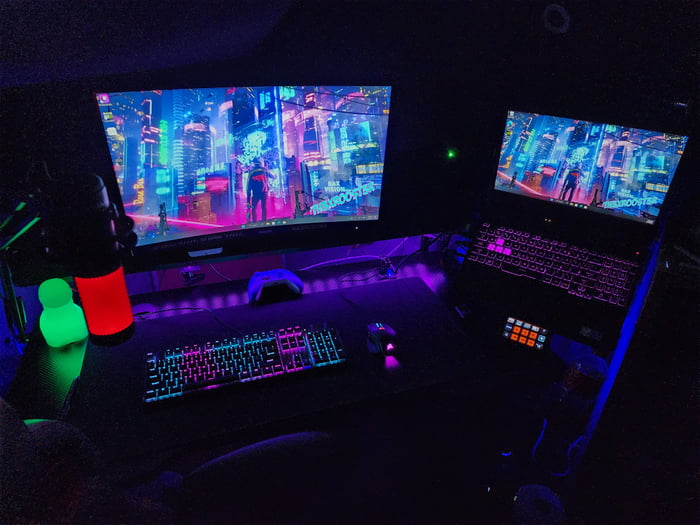
I want to click on monitor, so click(248, 171).